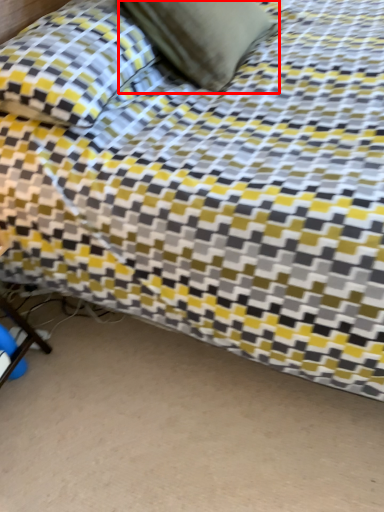
Question: From the image's perspective, what is the correct spatial relationship of pillow (annotated by the red box) in relation to pillow?

Choices:
 (A) above
 (B) below

Answer: (A)